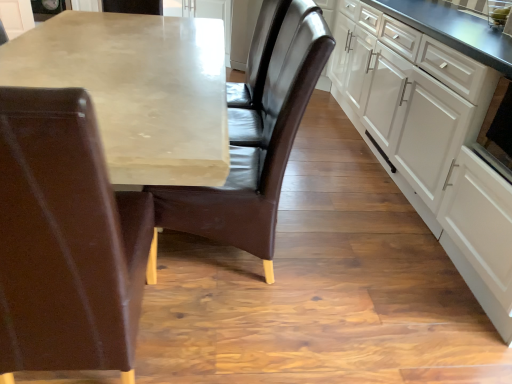
Question: Is matte concrete table at center positioned with its back to leather chair at left, which appears as the 2th chair when viewed from the right?

Choices:
 (A) yes
 (B) no

Answer: (B)

Question: Is matte concrete table at center positioned beyond the bounds of leather chair at left, which appears as the 2th chair when viewed from the right?

Choices:
 (A) no
 (B) yes

Answer: (B)

Question: Is matte concrete table at center to the left of leather chair at left, which appears as the 2th chair when viewed from the right, from the viewer's perspective?

Choices:
 (A) no
 (B) yes

Answer: (B)

Question: Is matte concrete table at center facing towards leather chair at left, which is the first chair from left to right?

Choices:
 (A) no
 (B) yes

Answer: (A)

Question: Does matte concrete table at center have a greater width compared to leather chair at left, which appears as the 2th chair when viewed from the right?

Choices:
 (A) no
 (B) yes

Answer: (B)

Question: Is leather chair at left, which is the first chair from left to right, spatially inside black glossy oven at right, or outside of it?

Choices:
 (A) inside
 (B) outside

Answer: (B)

Question: Considering the relative positions of leather chair at left, which is the first chair from left to right, and black glossy oven at right in the image provided, is leather chair at left, which is the first chair from left to right, to the left or to the right of black glossy oven at right?

Choices:
 (A) left
 (B) right

Answer: (A)

Question: Is point (14, 183) closer or farther from the camera than point (492, 153)?

Choices:
 (A) closer
 (B) farther

Answer: (A)

Question: Is leather chair at left, which is the first chair from left to right, bigger or smaller than black glossy oven at right?

Choices:
 (A) small
 (B) big

Answer: (B)

Question: Do you think white matte cabinet at right is within brown leather chair at center, which is counted as the 1th chair, starting from the right, or outside of it?

Choices:
 (A) inside
 (B) outside

Answer: (B)

Question: Relative to brown leather chair at center, which is the second chair from left to right, is white matte cabinet at right in front or behind?

Choices:
 (A) behind
 (B) front

Answer: (B)

Question: From the image's perspective, is white matte cabinet at right positioned above or below brown leather chair at center, which is counted as the 1th chair, starting from the right?

Choices:
 (A) below
 (B) above

Answer: (B)

Question: Considering the positions of point (409, 109) and point (260, 152), is point (409, 109) closer or farther from the camera than point (260, 152)?

Choices:
 (A) farther
 (B) closer

Answer: (A)

Question: Is matte concrete table at center wider or thinner than leather chair at left, which appears as the 2th chair when viewed from the right?

Choices:
 (A) wide
 (B) thin

Answer: (A)

Question: In terms of height, does matte concrete table at center look taller or shorter compared to leather chair at left, which is the first chair from left to right?

Choices:
 (A) short
 (B) tall

Answer: (A)